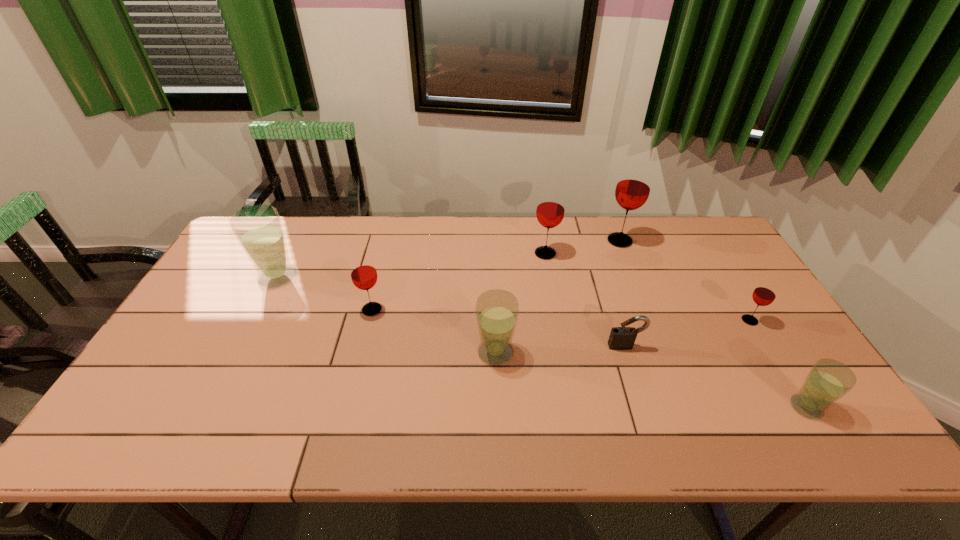
The width and height of the screenshot is (960, 540). Identify the location of blank region between the biggest red glass and the rightmost red glass. (684, 281).

I want to click on free space between the sixth glass from right to left and the nearest object, so click(589, 359).

What are the coordinates of `vacant region between the third glass from left to right and the fifth glass from left to right` in the screenshot? It's located at (558, 296).

The image size is (960, 540). In order to click on vacant area between the leftmost blue glass and the third smallest red glass in this screenshot , I will do `click(412, 265)`.

At what (x,y) coordinates should I click in order to perform the action: click on free space between the nearest blue glass and the tallest glass. Please return your answer as a coordinate pair (x, y). Looking at the image, I should click on (713, 324).

I want to click on unoccupied area between the fourth object from left to right and the tallest glass, so click(583, 247).

Identify the location of empty space between the second biggest red glass and the rightmost blue glass. The height and width of the screenshot is (540, 960). (x=676, y=330).

You are a GUI agent. You are given a task and a screenshot of the screen. Output one action in this format:
    pyautogui.click(x=<x>, y=<y>)
    Task: Click on the vacant area that lies between the third red glass from left to right and the smallest red glass
    The image size is (960, 540).
    Given the screenshot: What is the action you would take?
    pyautogui.click(x=684, y=281)

Identify the location of object that is the third closest to the fourth glass from left to right. (621, 338).

At what (x,y) coordinates should I click in order to perform the action: click on object that stands as the closest to the smallest red glass. Please return your answer as a coordinate pair (x, y). This screenshot has width=960, height=540. Looking at the image, I should click on (828, 380).